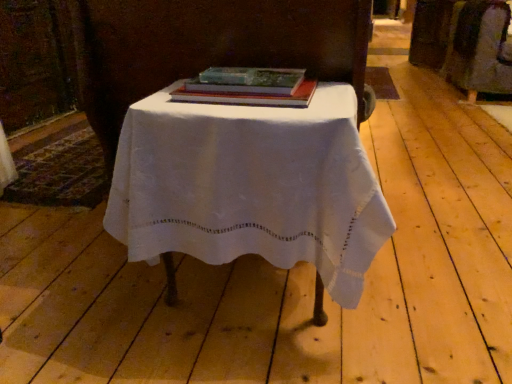
Identify the location of free space in front of translucent green glass book at center. This screenshot has height=384, width=512. (241, 111).